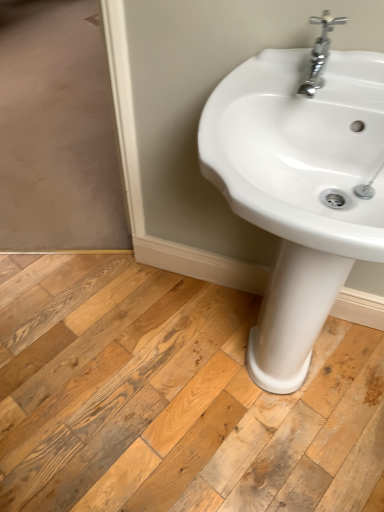
Where is `free space underneath white glossy sink at center (from a real-world perspective)`? The image size is (384, 512). free space underneath white glossy sink at center (from a real-world perspective) is located at coordinates (292, 379).